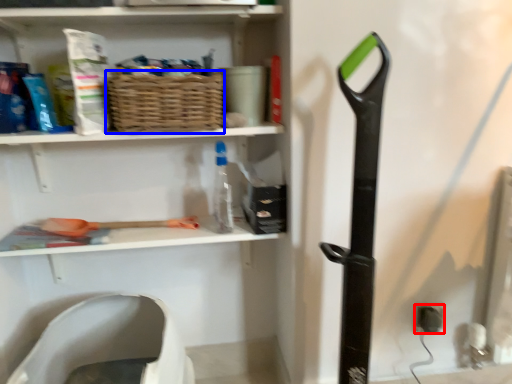
Question: Which of the following is the closest to the observer, electric outlet (highlighted by a red box) or basket (highlighted by a blue box)?

Choices:
 (A) electric outlet
 (B) basket

Answer: (B)